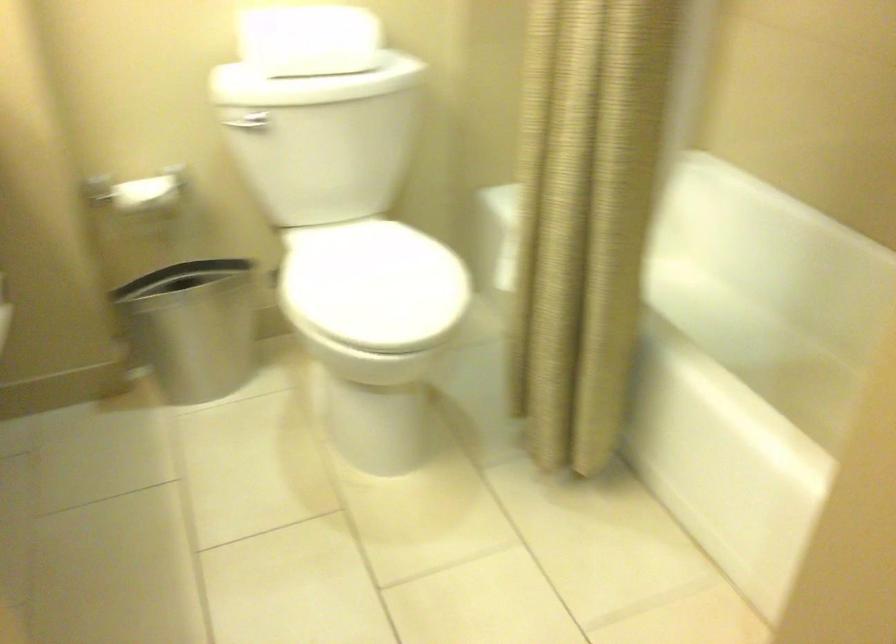
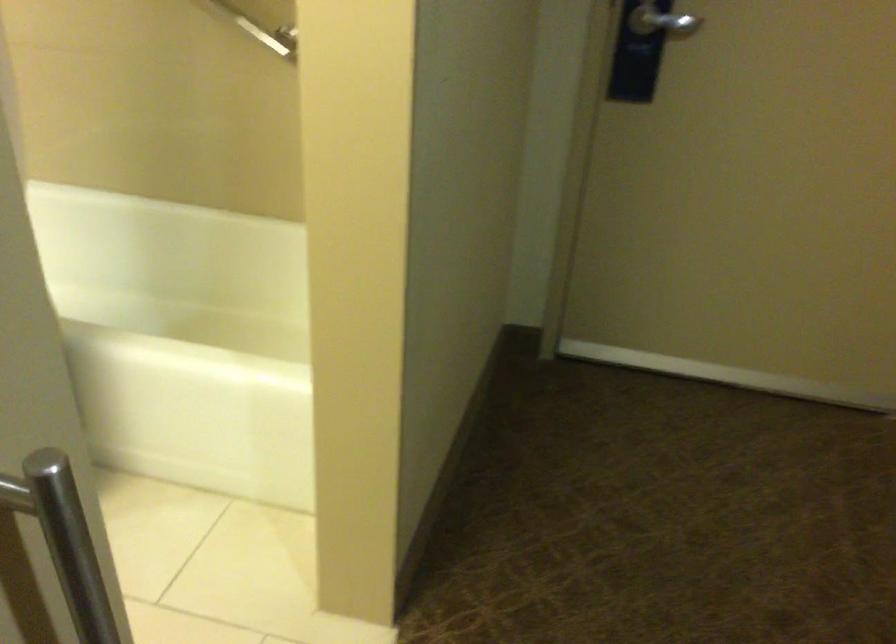
Question: The camera is either moving clockwise (left) or counter-clockwise (right) around the object. The first image is from the beginning of the video and the second image is from the end. Is the camera moving left or right when shooting the video?

Choices:
 (A) Left
 (B) Right

Answer: (A)